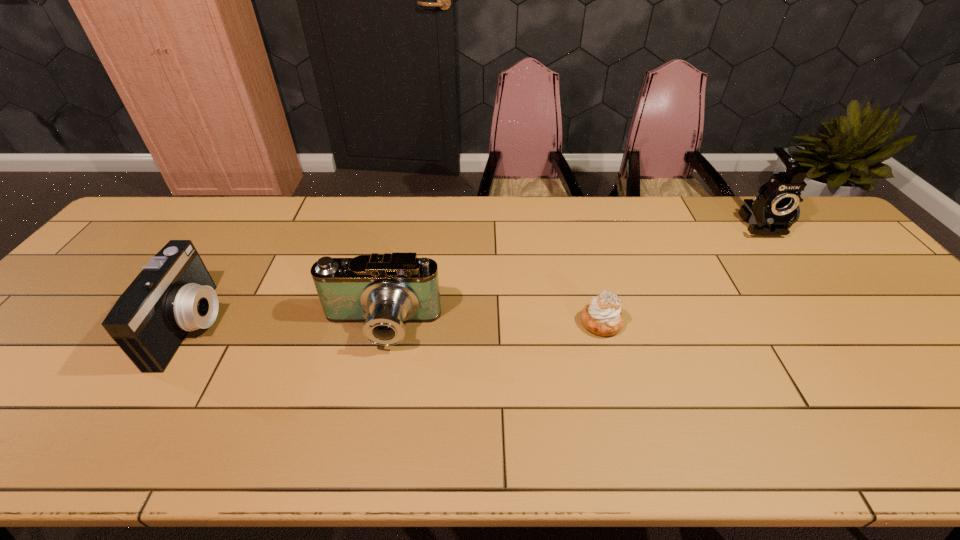
The height and width of the screenshot is (540, 960). I want to click on free point between the tallest camcorder and the leftmost object, so click(476, 274).

Locate an element on the screen. The image size is (960, 540). vacant space in between the second camcorder from left to right and the tallest camcorder is located at coordinates (570, 275).

Locate an element on the screen. unoccupied area between the third object from right to left and the tallest object is located at coordinates (570, 275).

Locate an element on the screen. Image resolution: width=960 pixels, height=540 pixels. empty space between the second camcorder from right to left and the farthest object is located at coordinates (570, 275).

Locate an element on the screen. vacant point located between the rightmost object and the leftmost camcorder is located at coordinates (476, 274).

Select which object appears as the third closest to the tallest object. Please provide its 2D coordinates. Your answer should be formatted as a tuple, i.e. [(x, y)], where the tuple contains the x and y coordinates of a point satisfying the conditions above.

[(174, 294)]

You are a GUI agent. You are given a task and a screenshot of the screen. Output one action in this format:
    pyautogui.click(x=<x>, y=<y>)
    Task: Click on the second closest object relative to the tallest object
    This screenshot has height=540, width=960.
    Given the screenshot: What is the action you would take?
    pyautogui.click(x=384, y=291)

Choose which camcorder is the nearest neighbor to the farthest object. Please provide its 2D coordinates. Your answer should be formatted as a tuple, i.e. [(x, y)], where the tuple contains the x and y coordinates of a point satisfying the conditions above.

[(384, 291)]

Locate an element on the screen. camcorder that is the nearest to the third object from left to right is located at coordinates (384, 291).

What are the coordinates of `free space that satisfies the following two spatial constraints: 1. on the lens mount of the tallest camcorder; 2. on the lens of the leftmost object` in the screenshot? It's located at (842, 326).